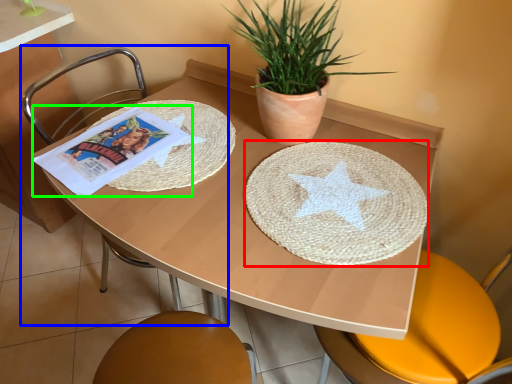
Question: Estimate the real-world distances between objects in this image. Which object is closer to paper plate (highlighted by a red box), chair (highlighted by a blue box) or comic book (highlighted by a green box)?

Choices:
 (A) chair
 (B) comic book

Answer: (B)